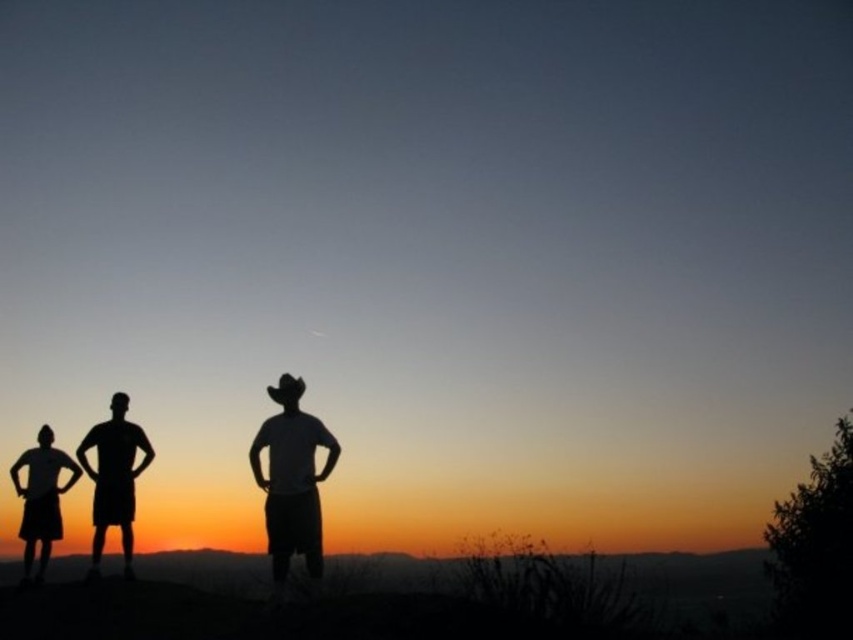
From the picture: You are a photographer trying to capture a group photo of the white matte cowboy hat at center and the silhouette child at left. The camera you are using has a maximum focus range of 15 feet. Can you take a photo of both subjects clearly without moving either of them?

The distance between the white matte cowboy hat at center and the silhouette child at left is 16.56 feet, which exceeds the camera maximum focus range of 15 feet. Therefore, you cannot take a photo of both subjects clearly without moving them.